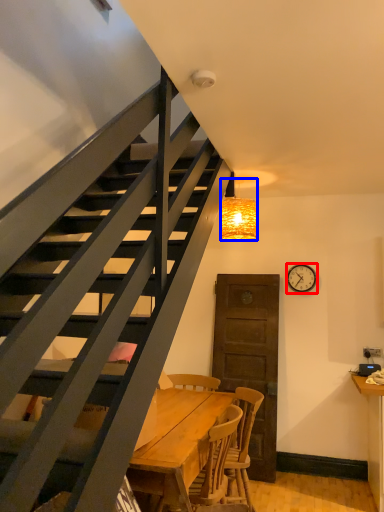
Question: Which object is closer to the camera taking this photo, clock (highlighted by a red box) or lamp (highlighted by a blue box)?

Choices:
 (A) clock
 (B) lamp

Answer: (B)